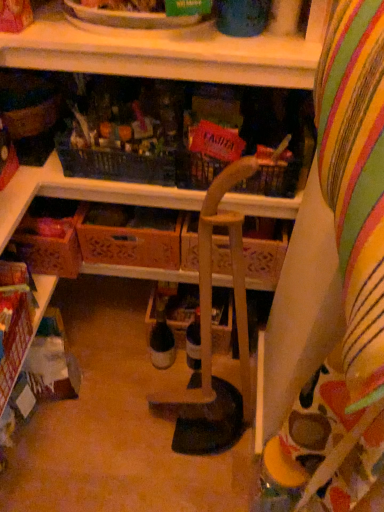
Where is `vacant position to the left of translucent glass bottle at center`? vacant position to the left of translucent glass bottle at center is located at coordinates (120, 360).